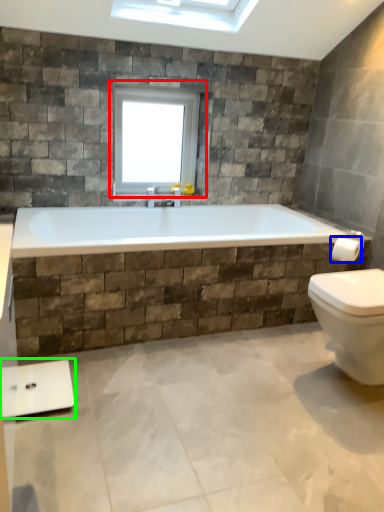
Question: Estimate the real-world distances between objects in this image. Which object is farther from window (highlighted by a red box), towel bar (highlighted by a blue box) or scale (highlighted by a green box)?

Choices:
 (A) towel bar
 (B) scale

Answer: (B)